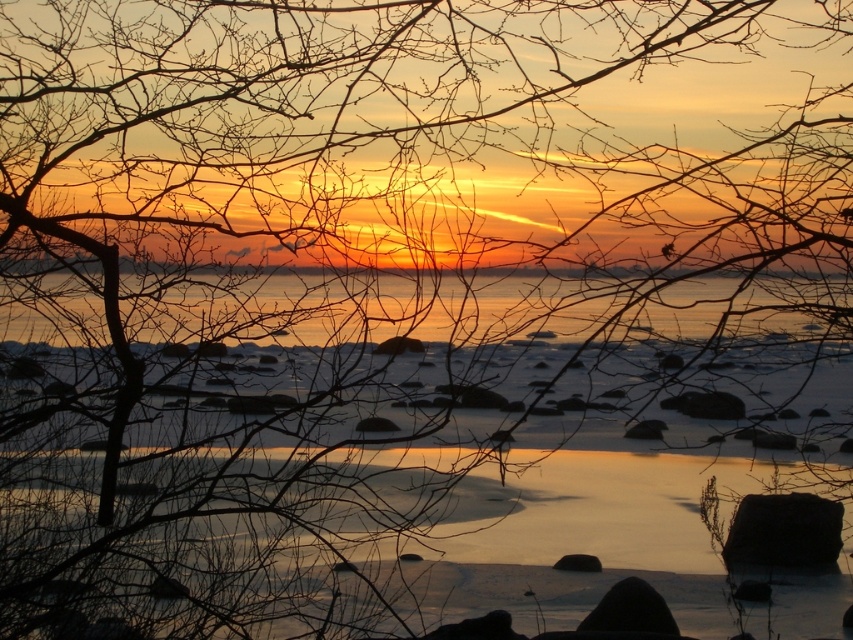
You are standing at the edge of the water and see the black matte stone at lower right and the black smooth rock at lower center. Which object is closer to the water surface?

The black smooth rock at lower center is closer to the water surface because the black matte stone at lower right is located above it.

You are a photographer trying to capture the sunset reflection on the water. You notice the black matte stone at lower right and the black smooth rock at lower center. Which object is closer to the camera, and why?

The black matte stone at lower right is closer to the camera because the black smooth rock at lower center is positioned behind it.